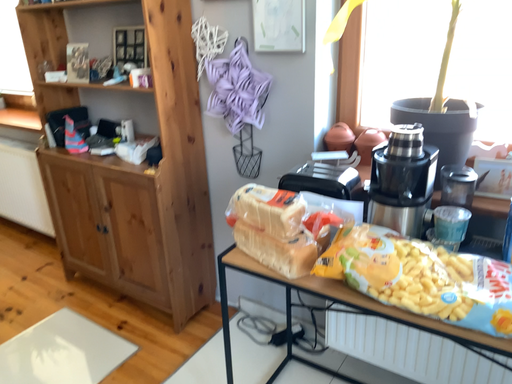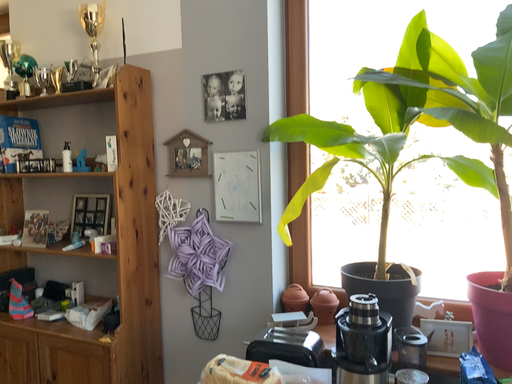
Question: Which way did the camera rotate in the video?

Choices:
 (A) rotated downward
 (B) rotated upward

Answer: (B)